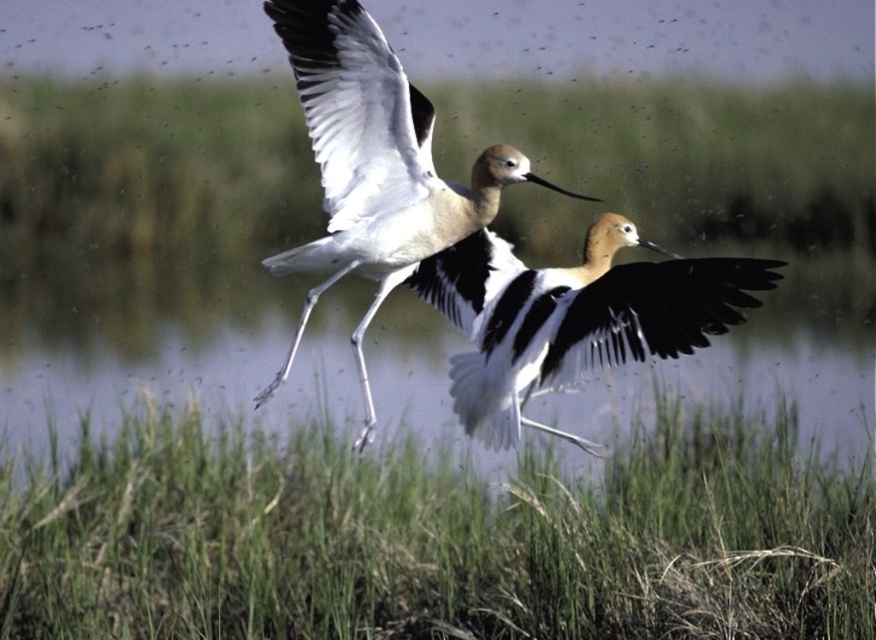
Is green grass at center thinner than white feathered bird at center?

No, green grass at center is not thinner than white feathered bird at center.

Does green grass at center appear over white feathered bird at center?

No, green grass at center is not above white feathered bird at center.

Is point (573, 497) closer to viewer compared to point (322, 29)?

That is False.

Locate an element on the screen. Image resolution: width=876 pixels, height=640 pixels. green grass at center is located at coordinates (433, 540).

Can you confirm if clear water at center is bigger than black and white feathers at center?

Yes, clear water at center is bigger than black and white feathers at center.

Between clear water at center and black and white feathers at center, which one is positioned lower?

black and white feathers at center is lower down.

Between point (799, 336) and point (444, 282), which one is positioned behind?

The point (799, 336) is more distant.

Locate an element on the screen. clear water at center is located at coordinates (145, 236).

Does black and white feathers at center appear under white feathered bird at center?

Correct, black and white feathers at center is located below white feathered bird at center.

Does black and white feathers at center have a greater height compared to white feathered bird at center?

In fact, black and white feathers at center may be shorter than white feathered bird at center.

Where is `black and white feathers at center`? The image size is (876, 640). black and white feathers at center is located at coordinates (571, 317).